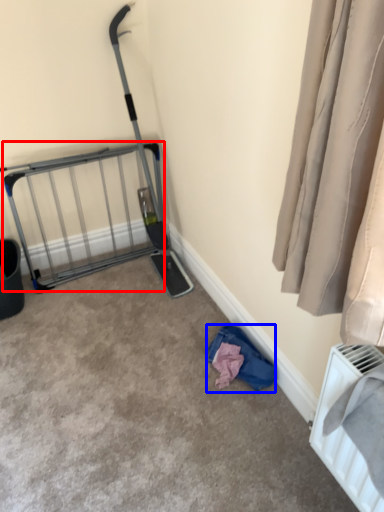
Question: Which object is closer to the camera taking this photo, cage (highlighted by a red box) or clothing (highlighted by a blue box)?

Choices:
 (A) cage
 (B) clothing

Answer: (B)